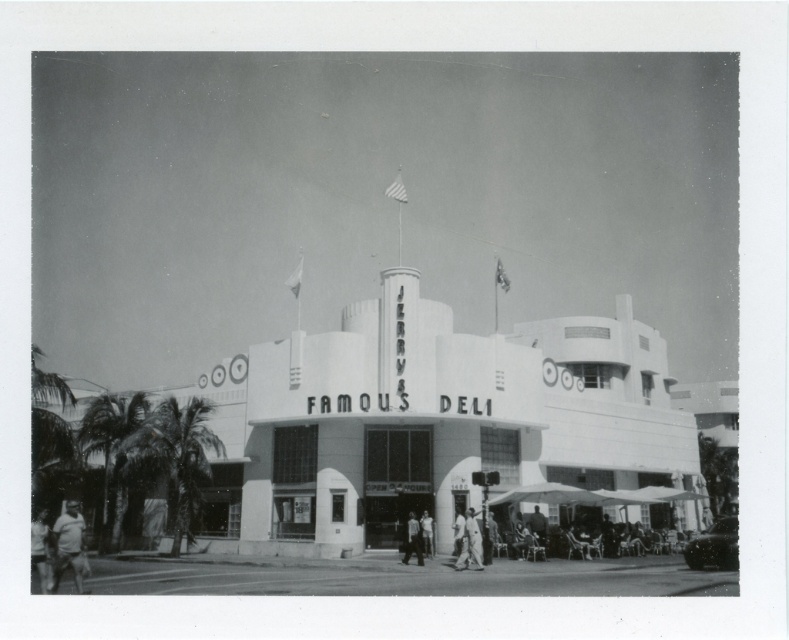
Which is in front, point (81, 528) or point (32, 547)?

Point (81, 528) is in front.

Who is positioned more to the left, light skin tone shirt at lower left or smooth skin person at lower left?

From the viewer's perspective, smooth skin person at lower left appears more on the left side.

What do you see at coordinates (68, 545) in the screenshot?
I see `light skin tone shirt at lower left` at bounding box center [68, 545].

Where is `light skin tone shirt at lower left`? The height and width of the screenshot is (640, 789). light skin tone shirt at lower left is located at coordinates (68, 545).

Is white cotton shirt at center to the right of smooth skin person at center from the viewer's perspective?

Indeed, white cotton shirt at center is positioned on the right side of smooth skin person at center.

Is white cotton shirt at center to the left of smooth skin person at center from the viewer's perspective?

No, white cotton shirt at center is not to the left of smooth skin person at center.

Where is `white cotton shirt at center`? white cotton shirt at center is located at coordinates (470, 544).

Locate an element on the screen. This screenshot has width=789, height=640. white cotton shirt at center is located at coordinates (470, 544).

Who is positioned more to the right, smooth skin person at lower left or smooth skin person at center?

smooth skin person at center

Does smooth skin person at lower left appear over smooth skin person at center?

Yes, smooth skin person at lower left is above smooth skin person at center.

The width and height of the screenshot is (789, 640). I want to click on smooth skin person at lower left, so click(x=40, y=550).